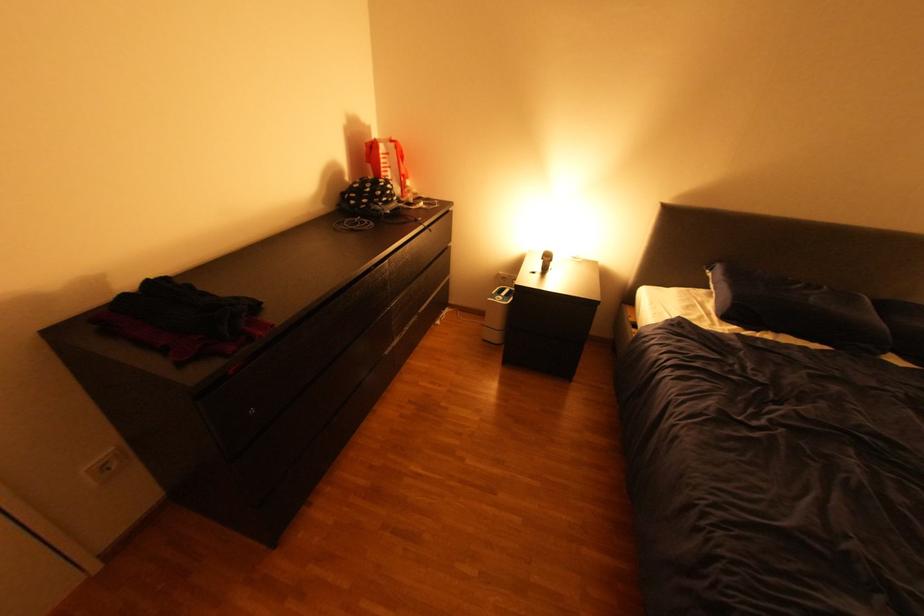
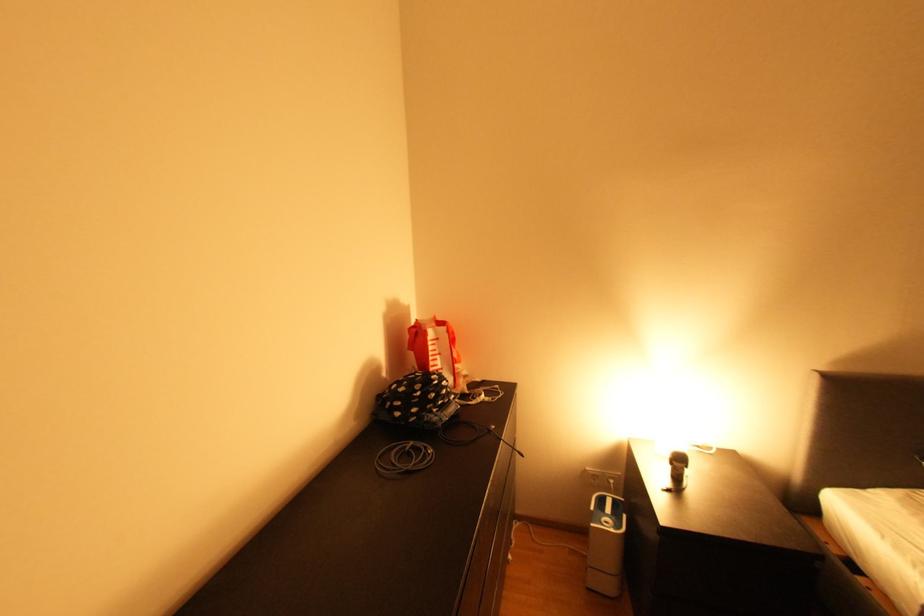
The point at (x=497, y=299) is marked in the first image. Where is the corresponding point in the second image?

(602, 525)